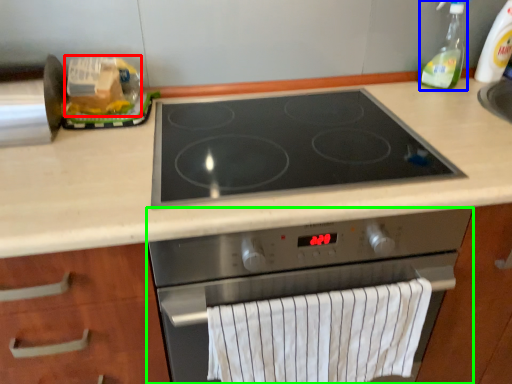
Question: Which is nearer to the food (highlighted by a red box)? soap dispenser (highlighted by a blue box) or kitchen appliance (highlighted by a green box).

Choices:
 (A) soap dispenser
 (B) kitchen appliance

Answer: (B)